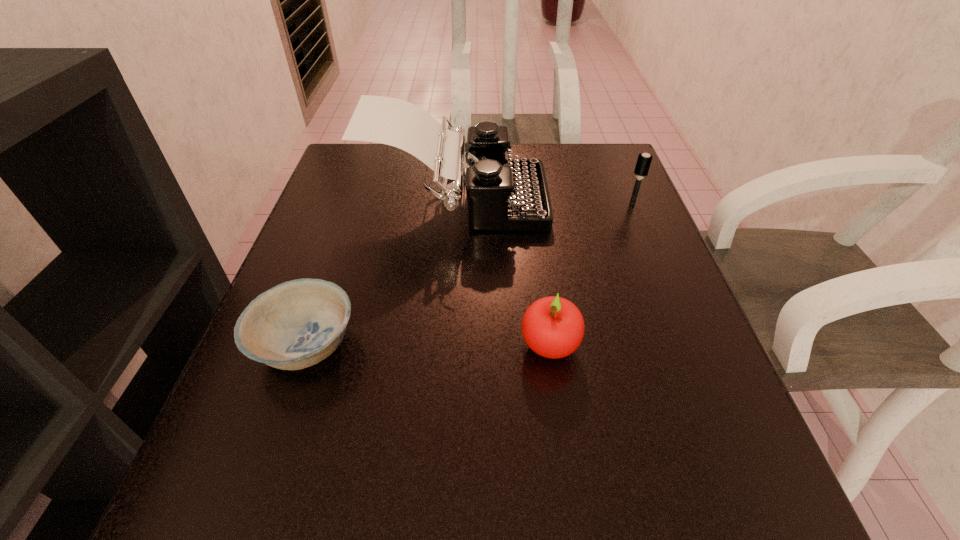
You are a GUI agent. You are given a task and a screenshot of the screen. Output one action in this format:
    pyautogui.click(x=<x>, y=<y>)
    Task: Click on the bowl located at the left edge
    Image resolution: width=960 pixels, height=540 pixels.
    Given the screenshot: What is the action you would take?
    pyautogui.click(x=296, y=324)

Identify the location of object that is at the right edge. (644, 160).

Where is `object present at the far left corner`? object present at the far left corner is located at coordinates (503, 194).

Where is `free space at the far edge`? free space at the far edge is located at coordinates [x=515, y=148].

The width and height of the screenshot is (960, 540). I want to click on vacant region at the near edge of the desktop, so click(x=410, y=493).

Identify the location of free space at the right edge of the desktop. (747, 458).

Image resolution: width=960 pixels, height=540 pixels. Find the location of `vacant area at the far left corner`. vacant area at the far left corner is located at coordinates (373, 167).

Image resolution: width=960 pixels, height=540 pixels. Find the location of `free location at the far right corner`. free location at the far right corner is located at coordinates (628, 168).

Locate an element on the screen. This screenshot has width=960, height=540. blank space at the near right corner of the desktop is located at coordinates (740, 514).

At what (x,y) coordinates should I click in order to perform the action: click on free spot between the hairbrush and the apple. Please return your answer as a coordinate pair (x, y). The height and width of the screenshot is (540, 960). Looking at the image, I should click on (590, 274).